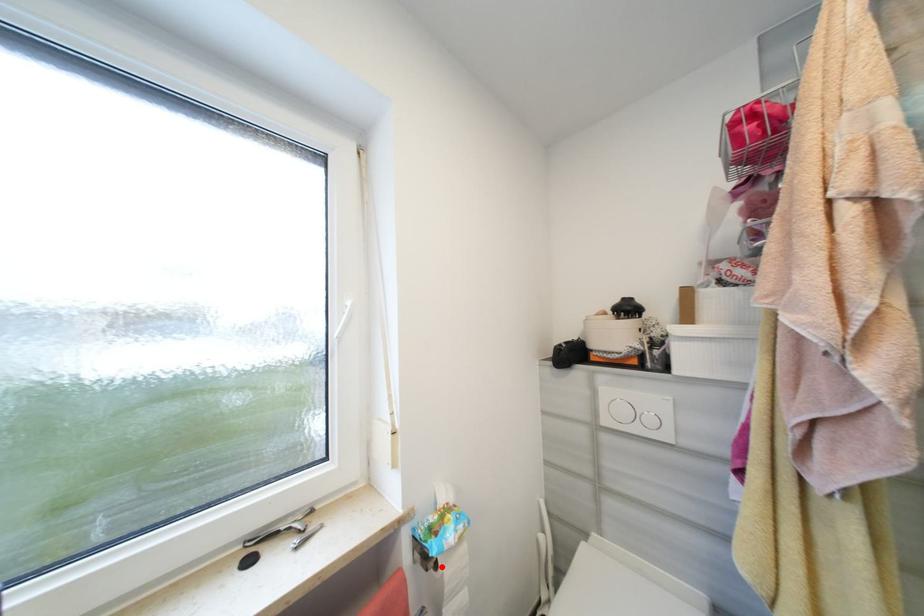
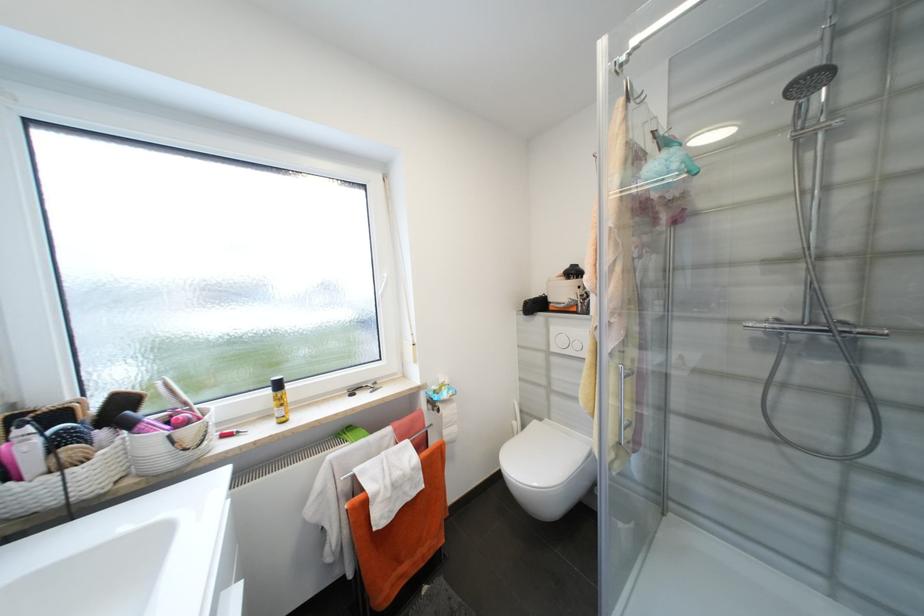
Locate, in the second image, the point that corresponds to the highlighted location in the first image.

(444, 411)